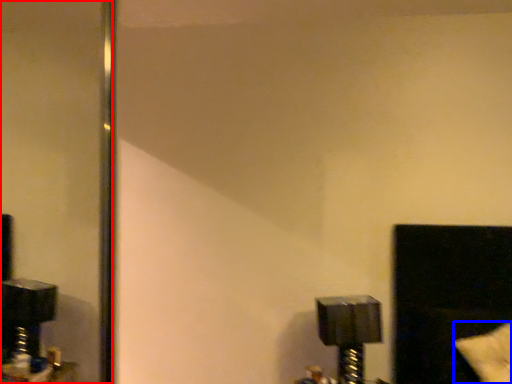
Question: Which object is closer to the camera taking this photo, mirror (highlighted by a red box) or pillow (highlighted by a blue box)?

Choices:
 (A) mirror
 (B) pillow

Answer: (B)